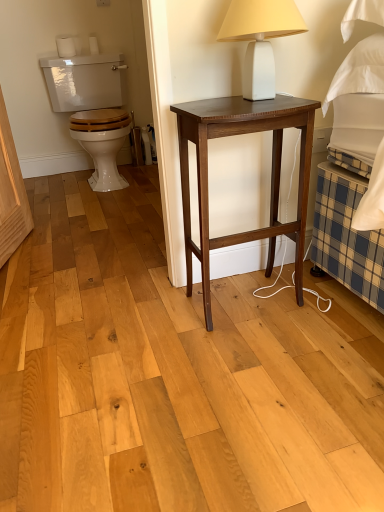
Question: Is white matte table lamp at upper center positioned far away from dark wood nightstand at center?

Choices:
 (A) no
 (B) yes

Answer: (A)

Question: Considering the relative sizes of white matte table lamp at upper center and dark wood nightstand at center in the image provided, is white matte table lamp at upper center wider than dark wood nightstand at center?

Choices:
 (A) yes
 (B) no

Answer: (B)

Question: From the image's perspective, is white matte table lamp at upper center above dark wood nightstand at center?

Choices:
 (A) yes
 (B) no

Answer: (A)

Question: Can you confirm if white matte table lamp at upper center is positioned to the right of dark wood nightstand at center?

Choices:
 (A) yes
 (B) no

Answer: (A)

Question: Is white matte table lamp at upper center taller than dark wood nightstand at center?

Choices:
 (A) no
 (B) yes

Answer: (A)

Question: Is dark wood nightstand at center wider or thinner than white glossy toilet at left?

Choices:
 (A) thin
 (B) wide

Answer: (A)

Question: Based on their sizes in the image, would you say dark wood nightstand at center is bigger or smaller than white glossy toilet at left?

Choices:
 (A) small
 (B) big

Answer: (A)

Question: From the image's perspective, is dark wood nightstand at center positioned above or below white glossy toilet at left?

Choices:
 (A) above
 (B) below

Answer: (B)

Question: In the image, is dark wood nightstand at center positioned in front of or behind white glossy toilet at left?

Choices:
 (A) front
 (B) behind

Answer: (A)

Question: From their relative heights in the image, would you say white matte toilet paper at upper left, the second toilet paper from the left, is taller or shorter than white matte table lamp at upper center?

Choices:
 (A) tall
 (B) short

Answer: (B)

Question: Is white matte toilet paper at upper left, the second toilet paper from the left, bigger or smaller than white matte table lamp at upper center?

Choices:
 (A) big
 (B) small

Answer: (B)

Question: Is white matte toilet paper at upper left, the second toilet paper from the left, inside the boundaries of white matte table lamp at upper center, or outside?

Choices:
 (A) inside
 (B) outside

Answer: (B)

Question: Looking at their shapes, would you say white matte toilet paper at upper left, the second toilet paper from the left, is wider or thinner than white matte table lamp at upper center?

Choices:
 (A) wide
 (B) thin

Answer: (B)

Question: Is dark wood nightstand at center wider or thinner than white matte toilet paper at upper left, which ranks as the 1th toilet paper in right-to-left order?

Choices:
 (A) wide
 (B) thin

Answer: (A)

Question: Considering the positions of dark wood nightstand at center and white matte toilet paper at upper left, the second toilet paper from the left, in the image, is dark wood nightstand at center taller or shorter than white matte toilet paper at upper left, the second toilet paper from the left,?

Choices:
 (A) short
 (B) tall

Answer: (B)